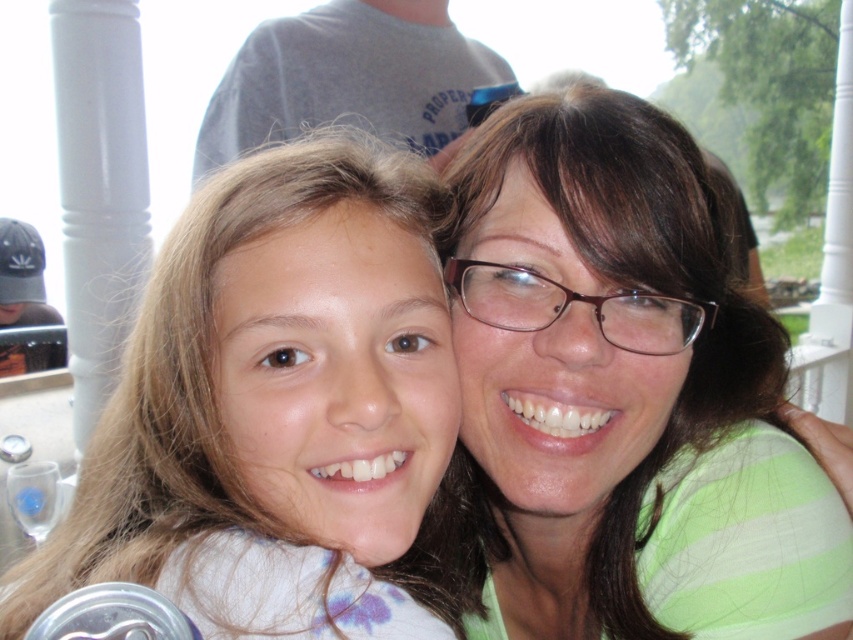
You are a photographer holding a camera that requires a minimum distance of 6 inches between the subject and the lens to focus properly. You want to capture a photo of the matte green shirt at center and the light brown hair at center. Based on their positions, will the camera be able to focus on both subjects?

The matte green shirt at center is 5.77 inches from the light brown hair at center. Since the required minimum distance is 6 inches, the camera cannot focus on both subjects because the distance between them is less than the required 6 inches.